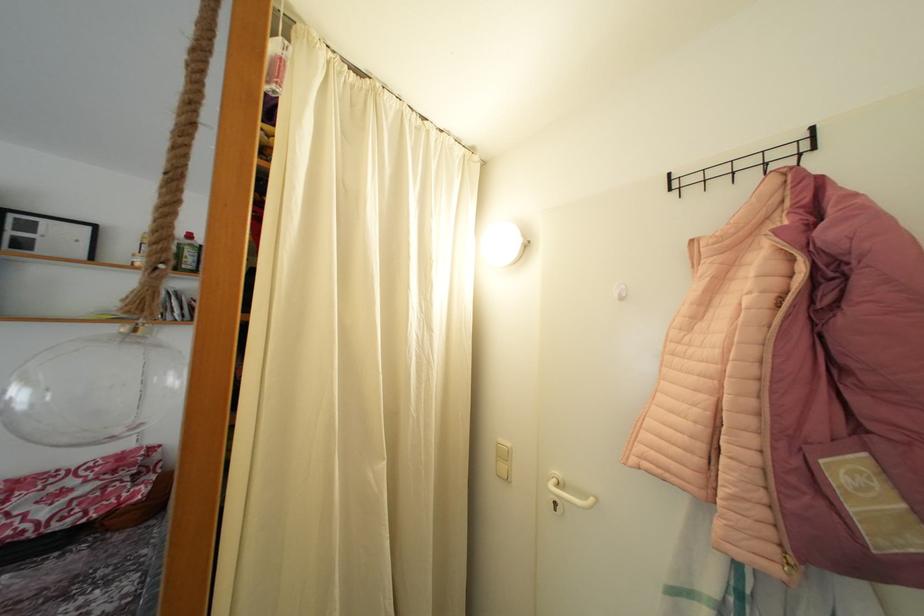
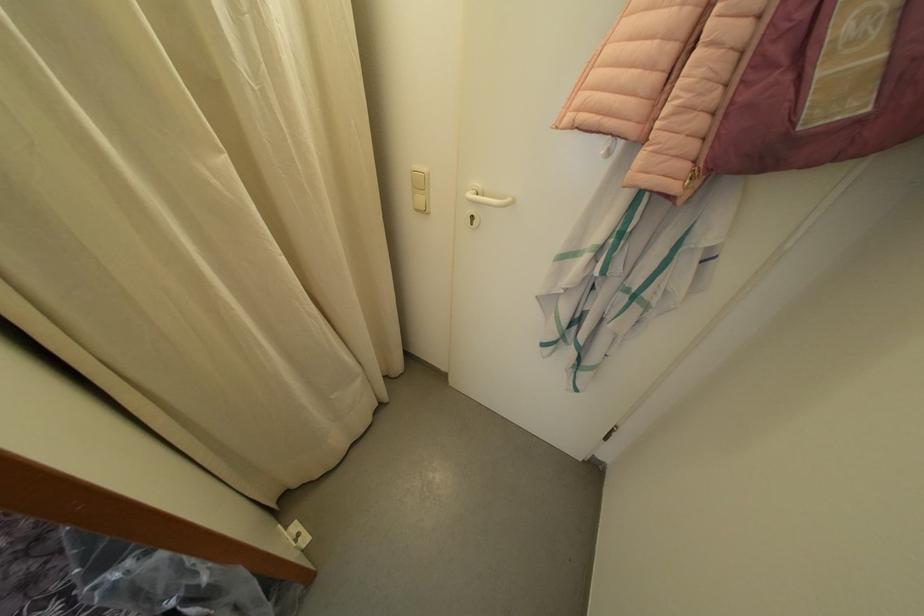
In the second image, find the point that corresponds to the point at 509,460 in the first image.

(427, 191)